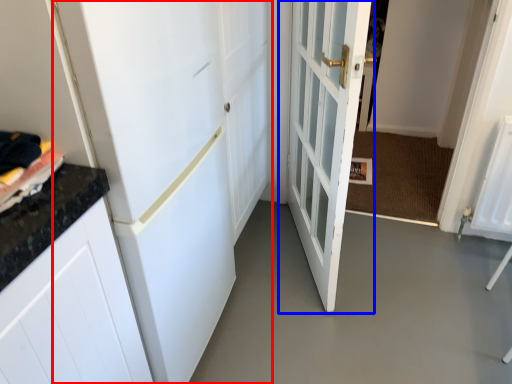
Question: Which of the following is the farthest to the observer, door (highlighted by a red box) or door (highlighted by a blue box)?

Choices:
 (A) door
 (B) door

Answer: (B)